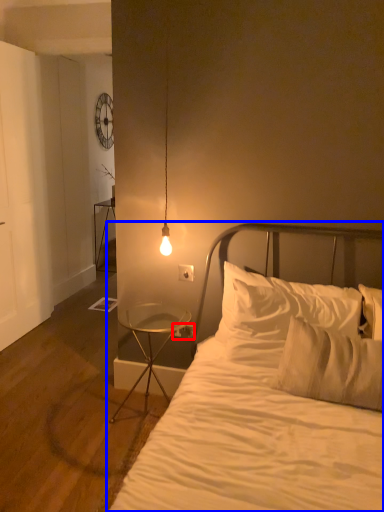
Question: Among these objects, which one is farthest to the camera, electric outlet (highlighted by a red box) or bed (highlighted by a blue box)?

Choices:
 (A) electric outlet
 (B) bed

Answer: (A)